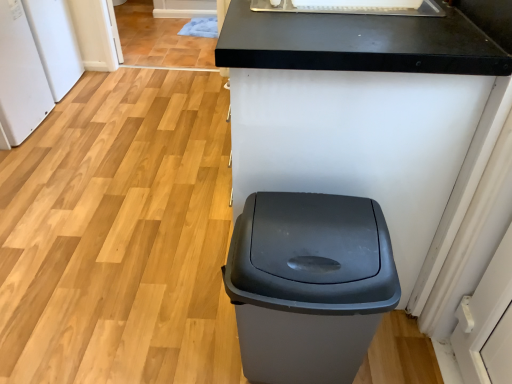
You are a GUI agent. You are given a task and a screenshot of the screen. Output one action in this format:
    pyautogui.click(x=<x>, y=<y>)
    Task: Click on the vacant space that is to the left of black matte counter at center
    Image resolution: width=512 pixels, height=384 pixels.
    Given the screenshot: What is the action you would take?
    pyautogui.click(x=119, y=227)